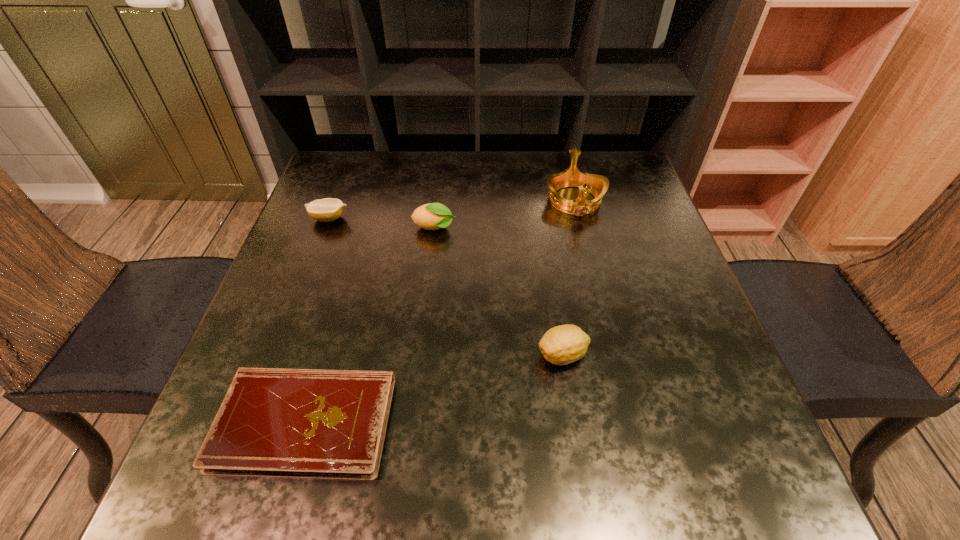
Find the location of `free point between the shortest lemon and the tiara`. free point between the shortest lemon and the tiara is located at coordinates (452, 210).

Image resolution: width=960 pixels, height=540 pixels. I want to click on empty space that is in between the tiara and the nearest lemon, so click(x=568, y=278).

Find the location of a particular element. This screenshot has height=540, width=960. empty location between the nearest lemon and the tallest object is located at coordinates (568, 278).

Locate an element on the screen. Image resolution: width=960 pixels, height=540 pixels. blank region between the second lemon from left to right and the rightmost lemon is located at coordinates (498, 292).

In order to click on unoccupied area between the shortest object and the second lemon from left to right in this screenshot , I will do `click(370, 326)`.

What are the coordinates of `free spot between the tiara and the notebook` in the screenshot? It's located at (440, 312).

Identify which object is the fourth nearest to the second lemon from right to left. Please provide its 2D coordinates. Your answer should be formatted as a tuple, i.e. [(x, y)], where the tuple contains the x and y coordinates of a point satisfying the conditions above.

[(293, 423)]

Select which object is the third closest to the second nearest object. Please provide its 2D coordinates. Your answer should be formatted as a tuple, i.e. [(x, y)], where the tuple contains the x and y coordinates of a point satisfying the conditions above.

[(597, 185)]

Locate which lemon is the closest to the leftmost lemon. Please provide its 2D coordinates. Your answer should be formatted as a tuple, i.e. [(x, y)], where the tuple contains the x and y coordinates of a point satisfying the conditions above.

[(432, 216)]

Identify which lemon is the nearest to the second lemon from right to left. Please provide its 2D coordinates. Your answer should be formatted as a tuple, i.e. [(x, y)], where the tuple contains the x and y coordinates of a point satisfying the conditions above.

[(328, 209)]